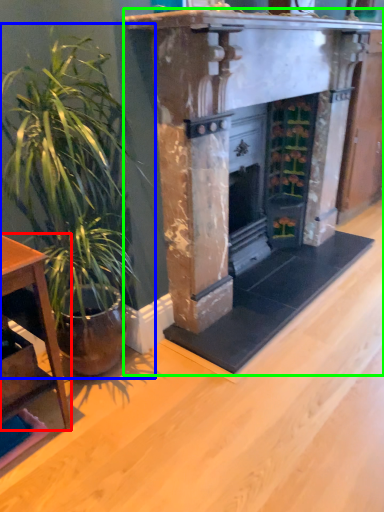
Question: Which object is the farthest from table (highlighted by a red box)? Choose among these: houseplant (highlighted by a blue box) or fireplace (highlighted by a green box).

Choices:
 (A) houseplant
 (B) fireplace

Answer: (B)